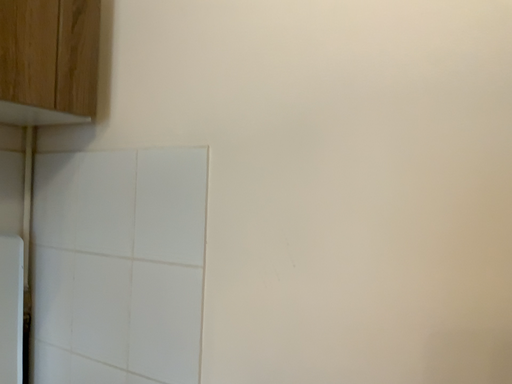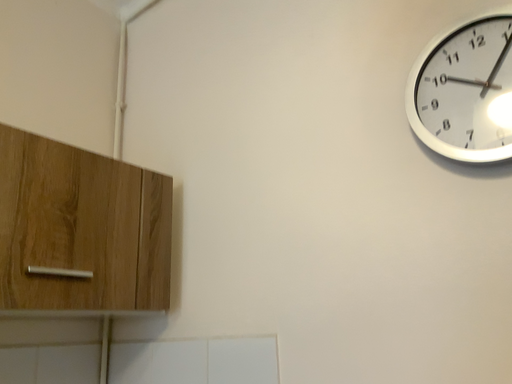
Question: Which way did the camera rotate in the video?

Choices:
 (A) rotated downward
 (B) rotated upward

Answer: (B)